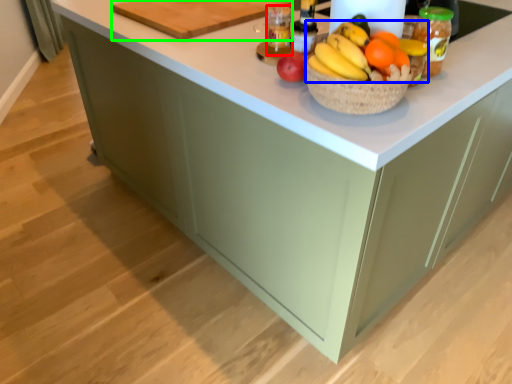
Question: Estimate the real-world distances between objects in this image. Which object is farther from bottle (highlighted by a red box), grapefruit (highlighted by a blue box) or cutting board (highlighted by a green box)?

Choices:
 (A) grapefruit
 (B) cutting board

Answer: (A)